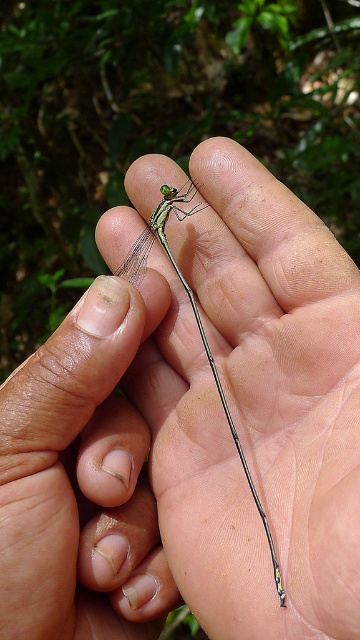
Is point (135, 522) farther from viewer compared to point (199, 330)?

That is False.

Which is more to the left, transparent glass mantid at center or transparent green dragonfly at center?

From the viewer's perspective, transparent glass mantid at center appears more on the left side.

Is point (105, 404) more distant than point (200, 208)?

No, (105, 404) is in front of (200, 208).

Image resolution: width=360 pixels, height=640 pixels. I want to click on transparent glass mantid at center, so click(82, 480).